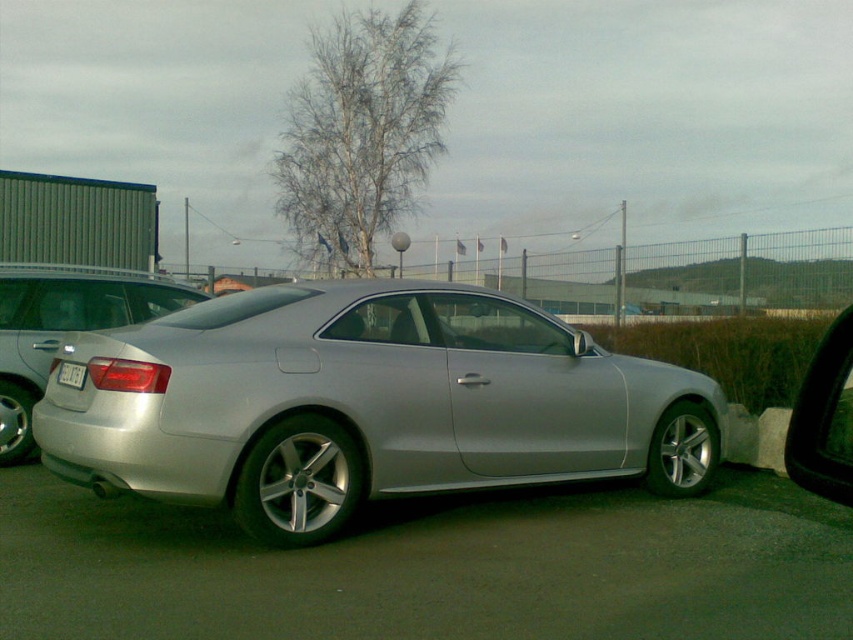
Between silver metallic car at center and white plastic license plate at rear, which one has more height?

Standing taller between the two is silver metallic car at center.

Between silver metallic car at center and white plastic license plate at rear, which one appears on the left side from the viewer's perspective?

Positioned to the left is white plastic license plate at rear.

Does point (494, 428) come closer to viewer compared to point (74, 364)?

That is False.

I want to click on silver metallic car at center, so click(x=364, y=404).

Who is positioned more to the left, satin silver car at center or black glossy view mirror at right?

From the viewer's perspective, satin silver car at center appears more on the left side.

Where is `satin silver car at center`? This screenshot has height=640, width=853. satin silver car at center is located at coordinates (62, 326).

Between silver metallic car at center and satin silver car at center, which one appears on the right side from the viewer's perspective?

From the viewer's perspective, silver metallic car at center appears more on the right side.

Find the location of a particular element. The width and height of the screenshot is (853, 640). silver metallic car at center is located at coordinates (364, 404).

This screenshot has width=853, height=640. I want to click on silver metallic car at center, so click(x=364, y=404).